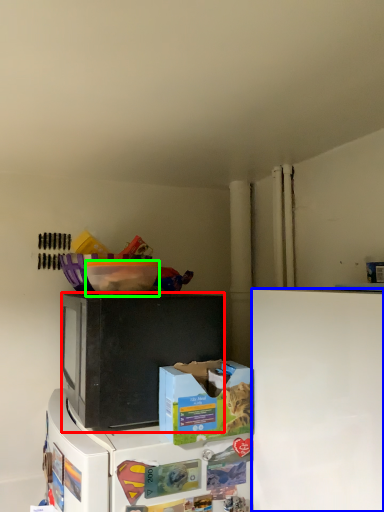
Question: Which object is the farthest from microwave oven (highlighted by a red box)? Choose among these: refrigerator (highlighted by a blue box) or bowl (highlighted by a green box).

Choices:
 (A) refrigerator
 (B) bowl

Answer: (A)